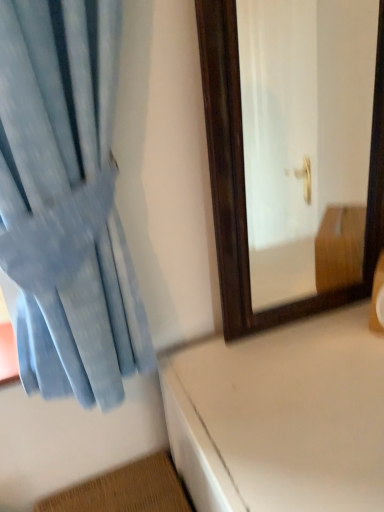
The image size is (384, 512). Describe the element at coordinates (281, 417) in the screenshot. I see `white glossy table at lower right` at that location.

At what (x,y) coordinates should I click in order to perform the action: click on white glossy table at lower right. Please return your answer as a coordinate pair (x, y). Looking at the image, I should click on (281, 417).

Describe the element at coordinates (66, 202) in the screenshot. I see `light blue fabric curtain at left` at that location.

Locate an element on the screen. Image resolution: width=384 pixels, height=512 pixels. light blue fabric curtain at left is located at coordinates (66, 202).

The width and height of the screenshot is (384, 512). Identify the location of white glossy table at lower right. (281, 417).

Considering the relative positions of white glossy table at lower right and light blue fabric curtain at left in the image provided, is white glossy table at lower right to the right of light blue fabric curtain at left from the viewer's perspective?

Indeed, white glossy table at lower right is positioned on the right side of light blue fabric curtain at left.

In the image, is white glossy table at lower right positioned in front of or behind light blue fabric curtain at left?

Visually, white glossy table at lower right is located behind light blue fabric curtain at left.

Is point (197, 457) farther from camera compared to point (124, 369)?

No.

From the image's perspective, is white glossy table at lower right above or below light blue fabric curtain at left?

Based on their image positions, white glossy table at lower right is located beneath light blue fabric curtain at left.

From the picture: From a real-world perspective, between white glossy table at lower right and light blue fabric curtain at left, who is vertically lower?

From a 3D spatial view, white glossy table at lower right is below.

Considering the relative sizes of white glossy table at lower right and light blue fabric curtain at left in the image provided, is white glossy table at lower right thinner than light blue fabric curtain at left?

No, white glossy table at lower right is not thinner than light blue fabric curtain at left.

Can you confirm if white glossy table at lower right is taller than light blue fabric curtain at left?

Correct, white glossy table at lower right is much taller as light blue fabric curtain at left.

Considering the relative sizes of white glossy table at lower right and light blue fabric curtain at left in the image provided, is white glossy table at lower right bigger than light blue fabric curtain at left?

Yes, white glossy table at lower right is bigger than light blue fabric curtain at left.

Can light blue fabric curtain at left be found inside white glossy table at lower right?

No.

Consider the image. Is white glossy table at lower right placed right next to light blue fabric curtain at left?

No, white glossy table at lower right is not next to light blue fabric curtain at left.

Consider the image. Is white glossy table at lower right positioned with its back to light blue fabric curtain at left?

No.

The image size is (384, 512). I want to click on curtain above the white glossy table at lower right (from a real-world perspective), so click(x=66, y=202).

Visually, is light blue fabric curtain at left positioned to the left or to the right of white glossy table at lower right?

Clearly, light blue fabric curtain at left is on the left of white glossy table at lower right in the image.

Which object is further away from the camera, light blue fabric curtain at left or white glossy table at lower right?

white glossy table at lower right is more distant.

Is point (37, 237) more distant than point (217, 451)?

No, (37, 237) is closer to viewer.

From the image's perspective, which one is positioned higher, light blue fabric curtain at left or white glossy table at lower right?

light blue fabric curtain at left, from the image's perspective.

From a real-world perspective, which is physically below, light blue fabric curtain at left or white glossy table at lower right?

In real-world perspective, white glossy table at lower right is lower.

Considering the relative sizes of light blue fabric curtain at left and white glossy table at lower right in the image provided, is light blue fabric curtain at left thinner than white glossy table at lower right?

Yes, light blue fabric curtain at left is thinner than white glossy table at lower right.

Considering the sizes of light blue fabric curtain at left and white glossy table at lower right in the image, is light blue fabric curtain at left taller or shorter than white glossy table at lower right?

light blue fabric curtain at left is shorter than white glossy table at lower right.

Is light blue fabric curtain at left bigger than white glossy table at lower right?

Actually, light blue fabric curtain at left might be smaller than white glossy table at lower right.

Can white glossy table at lower right be found inside light blue fabric curtain at left?

No.

Is there a large distance between light blue fabric curtain at left and white glossy table at lower right?

A: That's not correct — light blue fabric curtain at left is a little close to white glossy table at lower right.

Is light blue fabric curtain at left oriented towards white glossy table at lower right?

No, light blue fabric curtain at left is not aimed at white glossy table at lower right.

The width and height of the screenshot is (384, 512). I want to click on curtain above the white glossy table at lower right (from the image's perspective), so click(66, 202).

In the image, there is a light blue fabric curtain at left. Where is `table below it (from the image's perspective)`? This screenshot has width=384, height=512. table below it (from the image's perspective) is located at coordinates (281, 417).

Identify the location of curtain lying above the white glossy table at lower right (from the image's perspective). (66, 202).